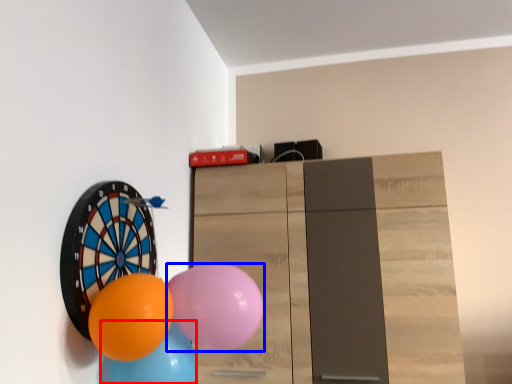
Question: Which object is closer to the camera taking this photo, balloon (highlighted by a red box) or balloon (highlighted by a blue box)?

Choices:
 (A) balloon
 (B) balloon

Answer: (B)